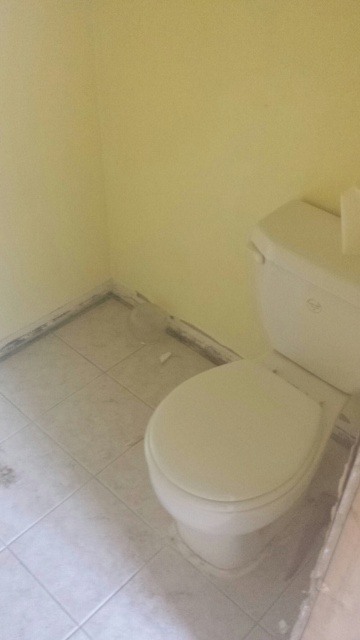
You are a cleaning professional assessing the bathroom. You need to clean both the white glossy toilet at right and the white matte toilet lid at center. Which object requires more attention to detail due to its smaller size?

The white matte toilet lid at center requires more attention to detail because it is smaller than the white glossy toilet at right.

You are a cleaning robot in a bathroom. You need to clean the white glossy toilet at right and the white matte toilet lid at center. Which object should you clean first if you want to start with the one closer to you?

You should clean the white glossy toilet at right first because it is closer to you than the white matte toilet lid at center according to the description.

You are standing in the bathroom and want to move from point A to point B. Point A is at coordinates point (240, 392) and point B is at coordinates point (182, 387). Given that the path between them is clear, will you walk towards the wall or away from the wall when moving from point A to point B?

Moving from point A to point B, since point A is in front of point B, you would be walking away from the wall as you move towards point B.